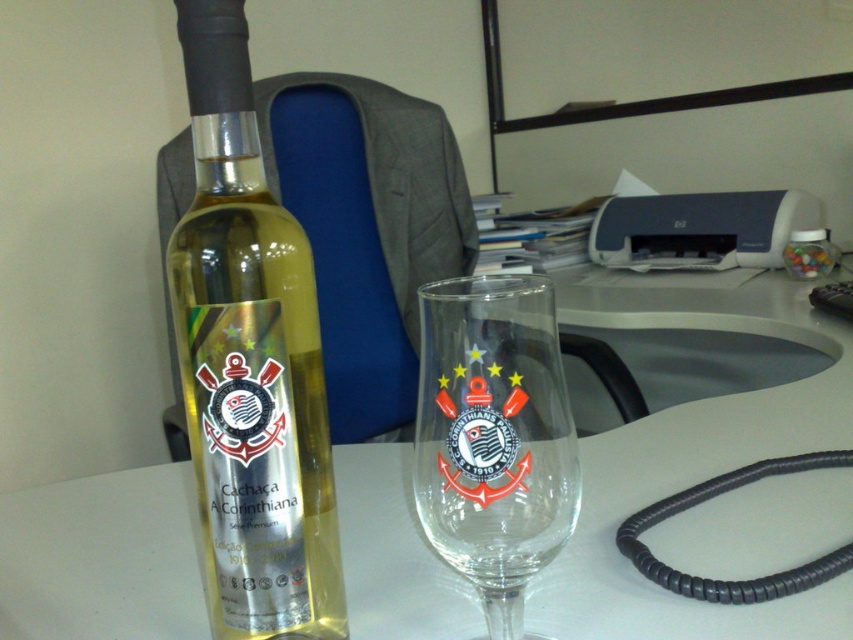
Who is shorter, white glossy table at center or translucent glass bottle at center?

With less height is white glossy table at center.

Can you confirm if white glossy table at center is positioned to the left of translucent glass bottle at center?

In fact, white glossy table at center is to the right of translucent glass bottle at center.

Between point (651, 323) and point (262, 323), which one is positioned in front?

Point (262, 323) is in front.

What are the coordinates of `white glossy table at center` in the screenshot? It's located at pyautogui.click(x=694, y=468).

Is point (645, 468) positioned before point (422, 444)?

No, (645, 468) is behind (422, 444).

This screenshot has height=640, width=853. Describe the element at coordinates (694, 468) in the screenshot. I see `white glossy table at center` at that location.

This screenshot has width=853, height=640. In order to click on white glossy table at center in this screenshot , I will do `click(694, 468)`.

Can you confirm if translucent glass bottle at center is smaller than transparent glass at center?

Actually, translucent glass bottle at center might be larger than transparent glass at center.

Who is lower down, translucent glass bottle at center or transparent glass at center?

transparent glass at center is lower down.

Where is `translucent glass bottle at center`? The width and height of the screenshot is (853, 640). translucent glass bottle at center is located at coordinates (250, 362).